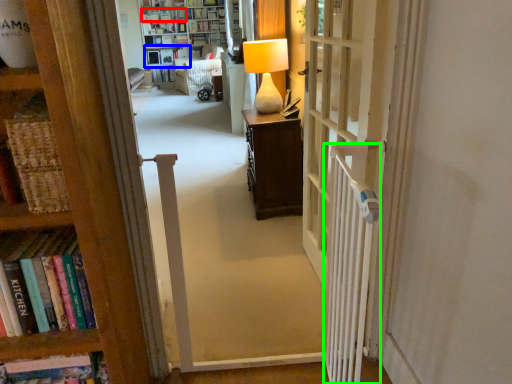
Question: Which object is positioned closest to book (highlighted by a red box)? Select from shelf (highlighted by a blue box) and radiator (highlighted by a green box).

Choices:
 (A) shelf
 (B) radiator

Answer: (A)